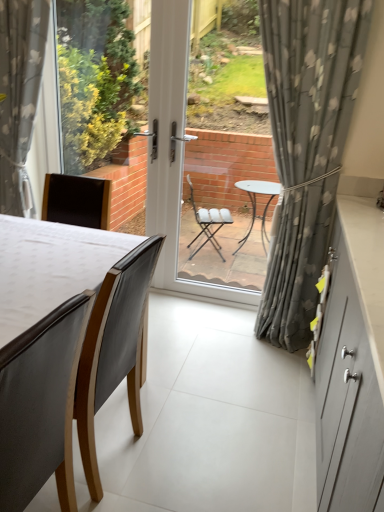
How much space does gray floral curtain at center, placed as the second curtain when sorted from left to right, occupy horizontally?

gray floral curtain at center, placed as the second curtain when sorted from left to right, is 6.50 inches in width.

The width and height of the screenshot is (384, 512). What are the coordinates of `gray floral curtain at center, positioned as the first curtain in right-to-left order` in the screenshot? It's located at pyautogui.click(x=306, y=146).

At what (x,y) coordinates should I click in order to perform the action: click on matte black chair at left, which ranks as the first chair in back-to-front order. Please return your answer as a coordinate pair (x, y). Looking at the image, I should click on (114, 349).

Measure the distance between transparent glass door at center and camera.

transparent glass door at center is 3.43 meters away from camera.

Where is `matte gray cabinet at right`? The height and width of the screenshot is (512, 384). matte gray cabinet at right is located at coordinates (352, 364).

At what (x,y) coordinates should I click in order to perform the action: click on gray floral curtain at center, placed as the second curtain when sorted from left to right. Please return your answer as a coordinate pair (x, y). The image size is (384, 512). Looking at the image, I should click on (306, 146).

Is point (220, 239) closer or farther from the camera than point (25, 115)?

Point (220, 239) appears to be farther away from the viewer than point (25, 115).

Is the depth of transparent glass door at center greater than that of gray floral fabric curtain at left, acting as the first curtain starting from the left?

Yes, transparent glass door at center is further from the viewer.

How different are the orientations of transparent glass door at center and gray floral fabric curtain at left, which is the second curtain from right to left, in degrees?

0.0347 degrees separate the facing orientations of transparent glass door at center and gray floral fabric curtain at left, which is the second curtain from right to left.

Where is `the 1st curtain in front of the transparent glass door at center, counting from the anchor's position`? the 1st curtain in front of the transparent glass door at center, counting from the anchor's position is located at coordinates (19, 97).

Does point (99, 482) come in front of point (348, 79)?

Yes, it is.

From the image's perspective, does matte black chair at left, acting as the 2th chair starting from the front, appear higher than gray floral curtain at center, placed as the second curtain when sorted from left to right?

No, from the image's perspective, matte black chair at left, acting as the 2th chair starting from the front, is not above gray floral curtain at center, placed as the second curtain when sorted from left to right.

Who is more distant, matte black chair at left, which ranks as the first chair in back-to-front order, or gray floral curtain at center, positioned as the first curtain in right-to-left order?

Positioned behind is gray floral curtain at center, positioned as the first curtain in right-to-left order.

How many degrees apart are the facing directions of matte black chair at left, acting as the 2th chair starting from the front, and gray floral curtain at center, positioned as the first curtain in right-to-left order?

They differ by 92.7 degrees in their facing directions.

From the image's perspective, is matte black chair at left, which ranks as the first chair in back-to-front order, located above or below matte gray cabinet at right?

matte black chair at left, which ranks as the first chair in back-to-front order, is below matte gray cabinet at right.

Can you confirm if matte black chair at left, which ranks as the first chair in back-to-front order, is smaller than matte gray cabinet at right?

Correct, matte black chair at left, which ranks as the first chair in back-to-front order, occupies less space than matte gray cabinet at right.

Between point (109, 283) and point (347, 416), which one is positioned behind?

Positioned behind is point (109, 283).

Which is correct: matte black chair at left, acting as the 2th chair starting from the front, is inside matte gray cabinet at right, or outside of it?

matte black chair at left, acting as the 2th chair starting from the front, is located beyond the bounds of matte gray cabinet at right.

Considering the sizes of objects gray floral curtain at center, placed as the second curtain when sorted from left to right, and transparent glass door at center in the image provided, who is smaller, gray floral curtain at center, placed as the second curtain when sorted from left to right, or transparent glass door at center?

transparent glass door at center.

Is gray floral curtain at center, positioned as the first curtain in right-to-left order, not within transparent glass door at center?

Indeed, gray floral curtain at center, positioned as the first curtain in right-to-left order, is completely outside transparent glass door at center.

The width and height of the screenshot is (384, 512). Find the location of `glass door above the gray floral curtain at center, positioned as the first curtain in right-to-left order (from the image's perspective)`. glass door above the gray floral curtain at center, positioned as the first curtain in right-to-left order (from the image's perspective) is located at coordinates (224, 167).

Does gray floral curtain at center, placed as the second curtain when sorted from left to right, have a greater height compared to transparent glass door at center?

No, gray floral curtain at center, placed as the second curtain when sorted from left to right, is not taller than transparent glass door at center.

Could you measure the distance between matte black chair at left, which ranks as the first chair in back-to-front order, and gray floral fabric curtain at left, which is the second curtain from right to left?

A distance of 5.05 feet exists between matte black chair at left, which ranks as the first chair in back-to-front order, and gray floral fabric curtain at left, which is the second curtain from right to left.

Is matte black chair at left, which ranks as the first chair in back-to-front order, turned away from gray floral fabric curtain at left, which is the second curtain from right to left?

No, matte black chair at left, which ranks as the first chair in back-to-front order, is not facing the opposite direction of gray floral fabric curtain at left, which is the second curtain from right to left.

Is matte black chair at left, which ranks as the first chair in back-to-front order, inside or outside of gray floral fabric curtain at left, which is the second curtain from right to left?

matte black chair at left, which ranks as the first chair in back-to-front order, is spatially situated outside gray floral fabric curtain at left, which is the second curtain from right to left.

Considering the relative positions of matte black chair at left, which ranks as the first chair in back-to-front order, and dark brown leather chair at lower left, placed as the first chair when sorted from front to back, in the image provided, is matte black chair at left, which ranks as the first chair in back-to-front order, to the left of dark brown leather chair at lower left, placed as the first chair when sorted from front to back, from the viewer's perspective?

No, matte black chair at left, which ranks as the first chair in back-to-front order, is not to the left of dark brown leather chair at lower left, placed as the first chair when sorted from front to back.

Image resolution: width=384 pixels, height=512 pixels. What are the coordinates of `chair above the dark brown leather chair at lower left, the 2th chair from the back (from the image's perspective)` in the screenshot? It's located at (114, 349).

Which is behind, point (135, 415) or point (34, 469)?

The point (135, 415) is behind.

Which of these two, matte gray cabinet at right or matte black chair at left, acting as the 2th chair starting from the front, is wider?

With larger width is matte gray cabinet at right.

Consider the image. Does matte gray cabinet at right have a larger size compared to matte black chair at left, which ranks as the first chair in back-to-front order?

Indeed, matte gray cabinet at right has a larger size compared to matte black chair at left, which ranks as the first chair in back-to-front order.

Who is taller, matte gray cabinet at right or matte black chair at left, acting as the 2th chair starting from the front?

Standing taller between the two is matte gray cabinet at right.

From a real-world perspective, is matte gray cabinet at right on matte black chair at left, acting as the 2th chair starting from the front?

Correct, in the physical world, matte gray cabinet at right is higher than matte black chair at left, acting as the 2th chair starting from the front.

Image resolution: width=384 pixels, height=512 pixels. In the image, there is a transparent glass door at center. Identify the location of curtain above it (from the image's perspective). (19, 97).

Find the location of a particular element. chair that is the 1st object located in front of the gray floral curtain at center, placed as the second curtain when sorted from left to right is located at coordinates (114, 349).

Based on their spatial positions, is gray floral fabric curtain at left, which is the second curtain from right to left, or transparent glass door at center further from matte gray cabinet at right?

transparent glass door at center is further to matte gray cabinet at right.

From the picture: Based on their spatial positions, is gray floral curtain at center, placed as the second curtain when sorted from left to right, or gray floral fabric curtain at left, acting as the first curtain starting from the left, further from matte black chair at left, which ranks as the first chair in back-to-front order?

The object further to matte black chair at left, which ranks as the first chair in back-to-front order, is gray floral fabric curtain at left, acting as the first curtain starting from the left.

Looking at the image, which one is located further to dark brown leather chair at lower left, placed as the first chair when sorted from front to back, matte gray cabinet at right or matte black chair at left, which ranks as the first chair in back-to-front order?

matte gray cabinet at right is positioned further to the anchor dark brown leather chair at lower left, placed as the first chair when sorted from front to back.

From the image, which object appears to be farther from gray floral curtain at center, placed as the second curtain when sorted from left to right, matte black chair at left, which ranks as the first chair in back-to-front order, or dark brown leather chair at lower left, the 2th chair from the back?

dark brown leather chair at lower left, the 2th chair from the back.

Considering their positions, is transparent glass door at center positioned closer to matte black chair at left, acting as the 2th chair starting from the front, than gray floral curtain at center, positioned as the first curtain in right-to-left order?

gray floral curtain at center, positioned as the first curtain in right-to-left order.

Which object lies further to the anchor point gray floral fabric curtain at left, acting as the first curtain starting from the left, dark brown leather chair at lower left, placed as the first chair when sorted from front to back, or matte gray cabinet at right?

The object further to gray floral fabric curtain at left, acting as the first curtain starting from the left, is matte gray cabinet at right.

When comparing their distances from matte black chair at left, acting as the 2th chair starting from the front, does dark brown leather chair at lower left, placed as the first chair when sorted from front to back, or gray floral curtain at center, positioned as the first curtain in right-to-left order, seem closer?

dark brown leather chair at lower left, placed as the first chair when sorted from front to back, is closer to matte black chair at left, acting as the 2th chair starting from the front.

Based on their spatial positions, is gray floral fabric curtain at left, which is the second curtain from right to left, or matte gray cabinet at right closer to matte black chair at left, which ranks as the first chair in back-to-front order?

matte gray cabinet at right is closer to matte black chair at left, which ranks as the first chair in back-to-front order.

At what (x,y) coordinates should I click in order to perform the action: click on glass door located between gray floral fabric curtain at left, acting as the first curtain starting from the left, and gray floral curtain at center, placed as the second curtain when sorted from left to right, in the left-right direction. Please return your answer as a coordinate pair (x, y). This screenshot has width=384, height=512. Looking at the image, I should click on (224, 167).

Where is `curtain between dark brown leather chair at lower left, placed as the first chair when sorted from front to back, and gray floral fabric curtain at left, which is the second curtain from right to left, in the front-back direction`? The width and height of the screenshot is (384, 512). curtain between dark brown leather chair at lower left, placed as the first chair when sorted from front to back, and gray floral fabric curtain at left, which is the second curtain from right to left, in the front-back direction is located at coordinates (306, 146).

Find the location of a particular element. chair between gray floral fabric curtain at left, acting as the first curtain starting from the left, and dark brown leather chair at lower left, the 2th chair from the back, from top to bottom is located at coordinates 114,349.

Identify the location of curtain between gray floral fabric curtain at left, which is the second curtain from right to left, and matte gray cabinet at right, in the horizontal direction. (306, 146).